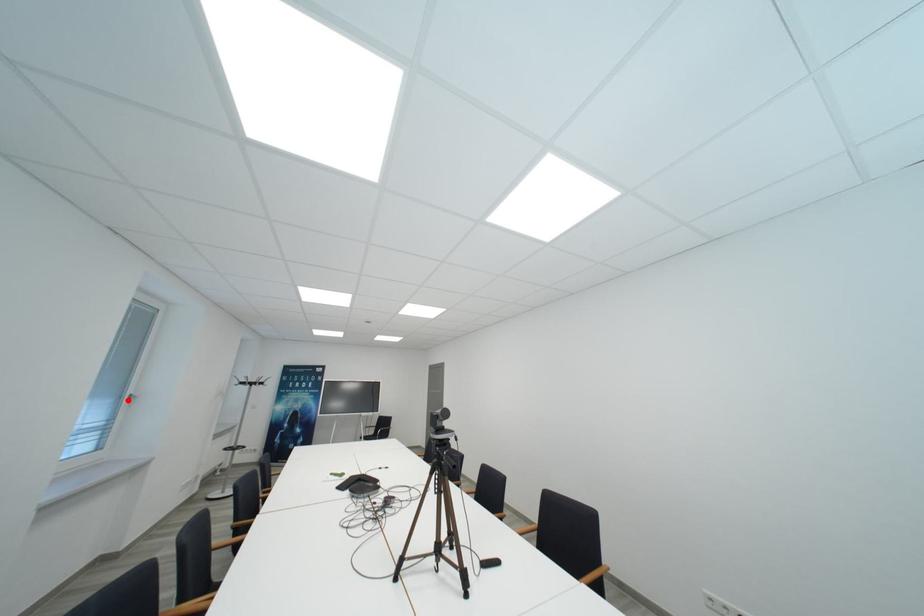
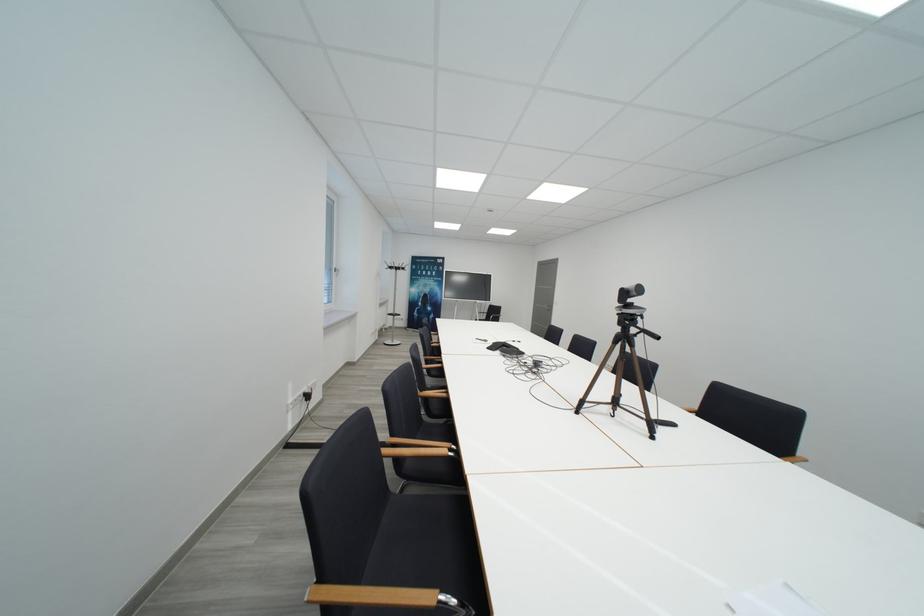
Question: A red point is marked in image1. In image2, is the corresponding 3D point closer to the camera or farther? Reply with the corresponding letter.

Choices:
 (A) The corresponding 3D point is closer.
 (B) The corresponding 3D point is farther.

Answer: (B)